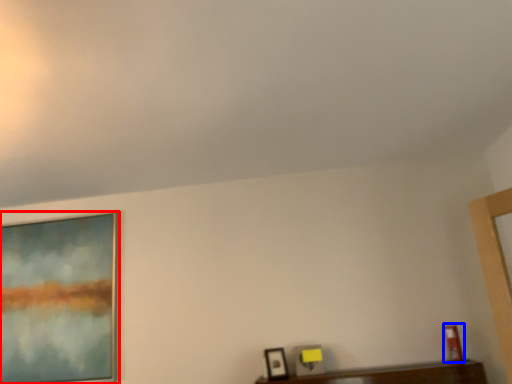
Question: Among these objects, which one is nearest to the camera, picture frame (highlighted by a red box) or picture frame (highlighted by a blue box)?

Choices:
 (A) picture frame
 (B) picture frame

Answer: (B)